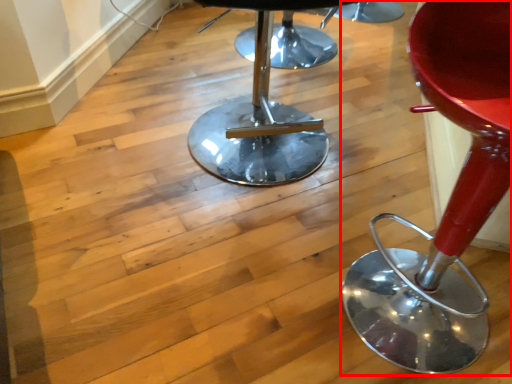
Question: From the image's perspective, considering the relative positions of chair (annotated by the red box) and stool in the image provided, where is chair (annotated by the red box) located with respect to the staircase?

Choices:
 (A) below
 (B) above

Answer: (A)